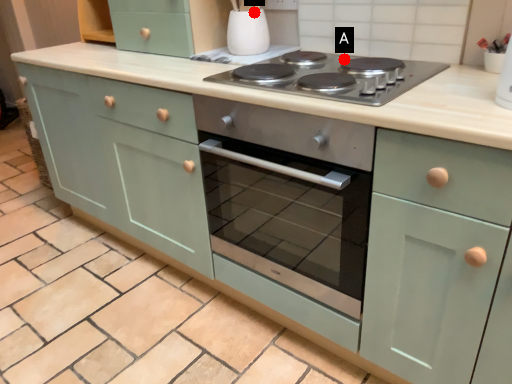
Question: Two points are circled on the image, labeled by A and B beside each circle. Which point is closer to the camera taking this photo?

Choices:
 (A) A is closer
 (B) B is closer

Answer: (A)